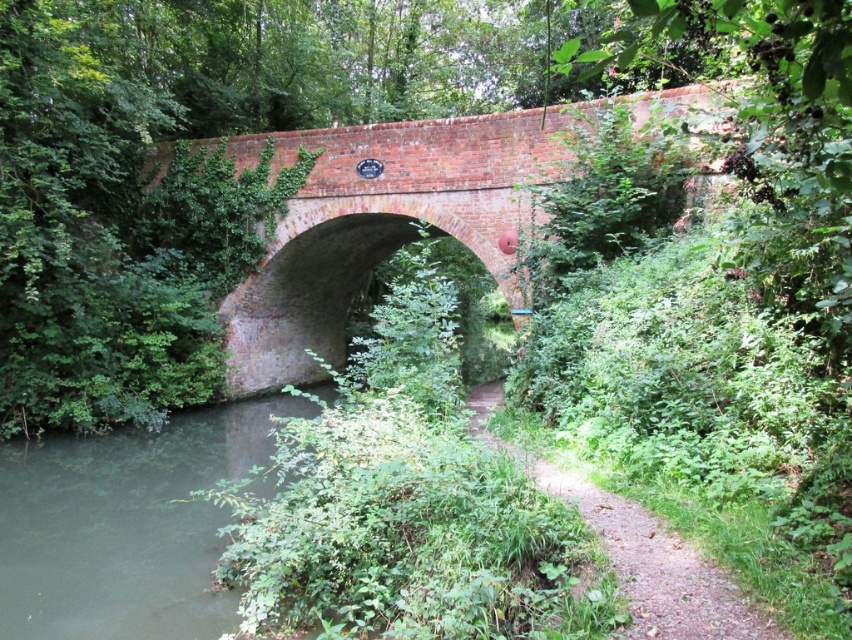
You are standing on the dirt path at center and want to cross to the other side. Is the green murky water at lower left between you and the opposite bank?

Yes, the green murky water at lower left is between you and the opposite bank since it is located below the dirt path at center.

You are standing on the brick bridge and looking towards the plaque. There are two points marked on the bridge surface at coordinates point [505,148] and point [697,625]. Which point is closer to you as you face the plaque?

Point [505,148] is further to the viewer than point [697,625]. Therefore, point [697,625] is closer to you when facing the plaque.

In the scene shown: You are planning to walk across the brick bridge and need to step on the brick at center and dirt path at center. Which surface should you choose to ensure stability, considering their sizes?

The brick at center has a larger size compared to dirt path at center, so stepping on the brick at center would provide more stability due to its larger surface area.